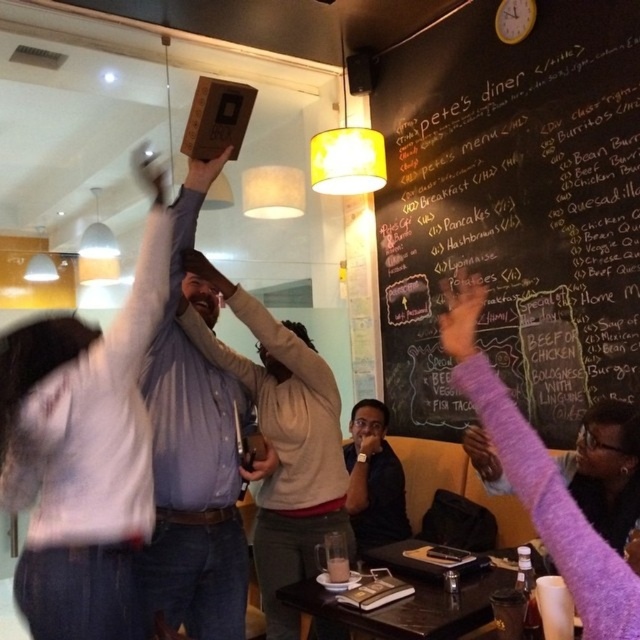
You are a photographer at Pete Diner and you need to take a group photo of the matte blue shirt at center and the black matte shirt at center. Since you want both to appear the same size in the photo, which one should you move closer to the camera?

The matte blue shirt at center is larger in real life, so you should move the matte blue shirt at center closer to the camera to make it appear the same size as the black matte shirt at center in the photo.

You are standing at the entrance of Pete s Diner and see two points marked on the floor. The first point is at coordinate point (545, 81) and the second point is at coordinate point (388, 540). Which point is closer to you?

Point (545, 81) is in front of point (388, 540), so it is closer to you.